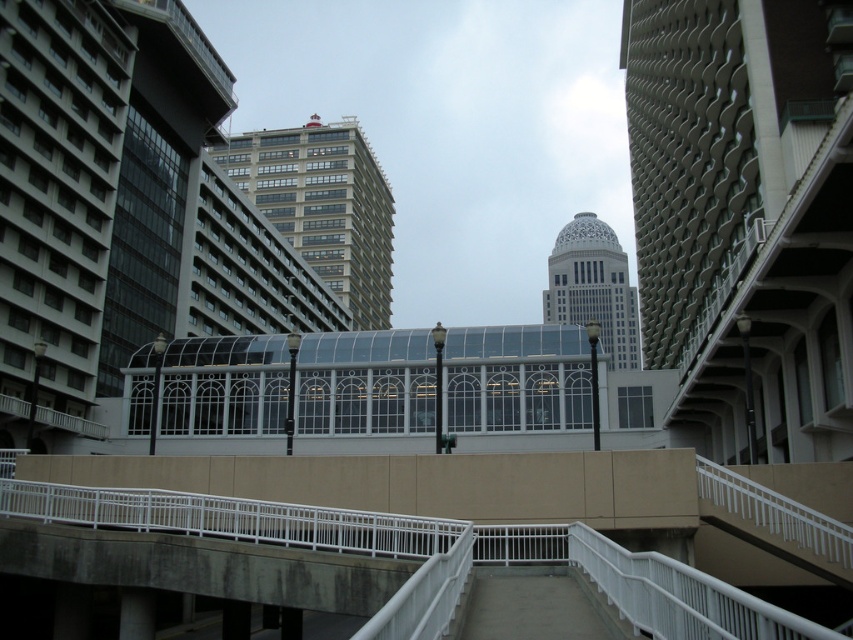
You are standing on the pedestrian bridge with white railings and want to locate the beige glass building at center. According to the coordinates provided, where exactly should you look to find it?

The beige glass building at center is located at coordinates point (323, 205).

Looking at this image, you are standing on the pedestrian bridge and want to look at two points in the scene. Which point, point [373,161] or point [579,243], is closer to you?

Point [373,161] is closer to the viewer than point [579,243].

In the scene shown: You are an architect analyzing the urban layout. You notice the beige glass building at center and the white marble tower at center. Which one is positioned to the left when viewed from your perspective?

The beige glass building at center is to the left of the white marble tower at center, so the beige glass building at center is positioned to the left.